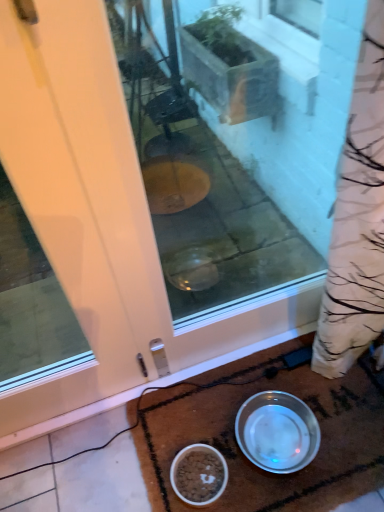
You are a GUI agent. You are given a task and a screenshot of the screen. Output one action in this format:
    pyautogui.click(x=<x>, y=<y>)
    Task: Click on the free spot behind silver metallic bowl at lower center, arranged as the 1th bowl when viewed from the right
    Image resolution: width=384 pixels, height=512 pixels.
    Given the screenshot: What is the action you would take?
    pyautogui.click(x=259, y=376)